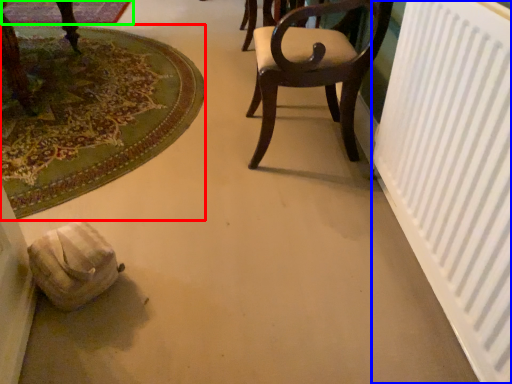
Question: Estimate the real-world distances between objects in this image. Which object is closer to mat (highlighted by a red box), radiator (highlighted by a blue box) or mat (highlighted by a green box)?

Choices:
 (A) radiator
 (B) mat

Answer: (B)